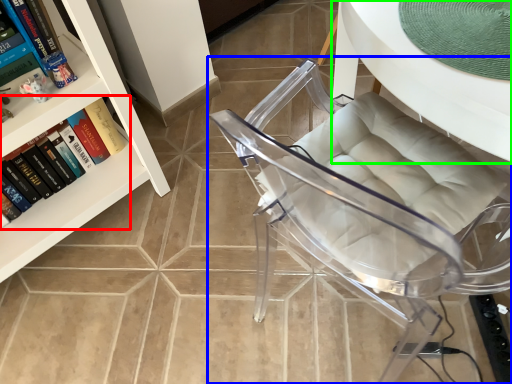
Question: Which object is the closest to the book (highlighted by a red box)? Choose among these: chair (highlighted by a blue box) or table (highlighted by a green box).

Choices:
 (A) chair
 (B) table

Answer: (A)